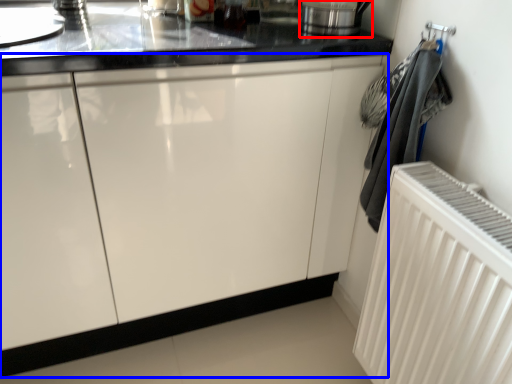
Question: Which object appears closest to the camera in this image, appliance (highlighted by a red box) or cabinetry (highlighted by a blue box)?

Choices:
 (A) appliance
 (B) cabinetry

Answer: (B)